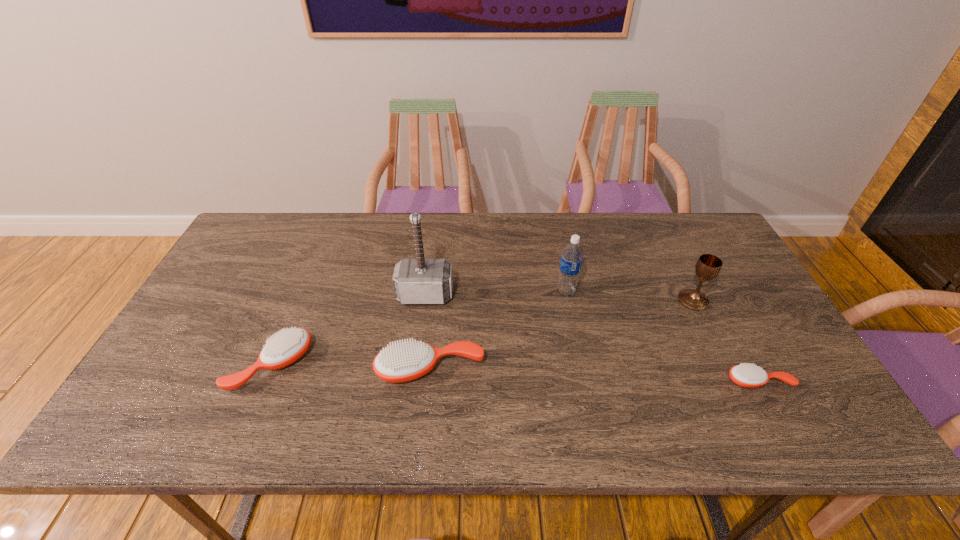
Locate an element on the screen. The width and height of the screenshot is (960, 540). vacant space at the right edge of the desktop is located at coordinates (728, 339).

This screenshot has height=540, width=960. What are the coordinates of `vacant space at the far left corner` in the screenshot? It's located at (258, 224).

In the image, there is a desktop. Where is `blank space at the near left corner`? The width and height of the screenshot is (960, 540). blank space at the near left corner is located at coordinates (214, 376).

Find the location of `free area in between the second hairbrush from right to left and the rightmost hairbrush`. free area in between the second hairbrush from right to left and the rightmost hairbrush is located at coordinates (594, 375).

Locate an element on the screen. The image size is (960, 540). vacant space in between the fifth tallest object and the fourth shortest object is located at coordinates 482,333.

Where is `free point between the water bottle and the second hairbrush from right to left`? Image resolution: width=960 pixels, height=540 pixels. free point between the water bottle and the second hairbrush from right to left is located at coordinates (498, 330).

Find the location of a particular element. free space between the second shortest object and the chalice is located at coordinates (482, 333).

Where is `free space between the second hairbrush from left to right and the fifth shortest object`? This screenshot has width=960, height=540. free space between the second hairbrush from left to right and the fifth shortest object is located at coordinates (498, 330).

The height and width of the screenshot is (540, 960). Identify the location of free space between the leftmost hairbrush and the rightmost hairbrush. (515, 373).

At what (x,y) coordinates should I click in order to perform the action: click on vacant region between the second shortest object and the second hairbrush from right to left. Please return your answer as a coordinate pair (x, y). Looking at the image, I should click on (350, 368).